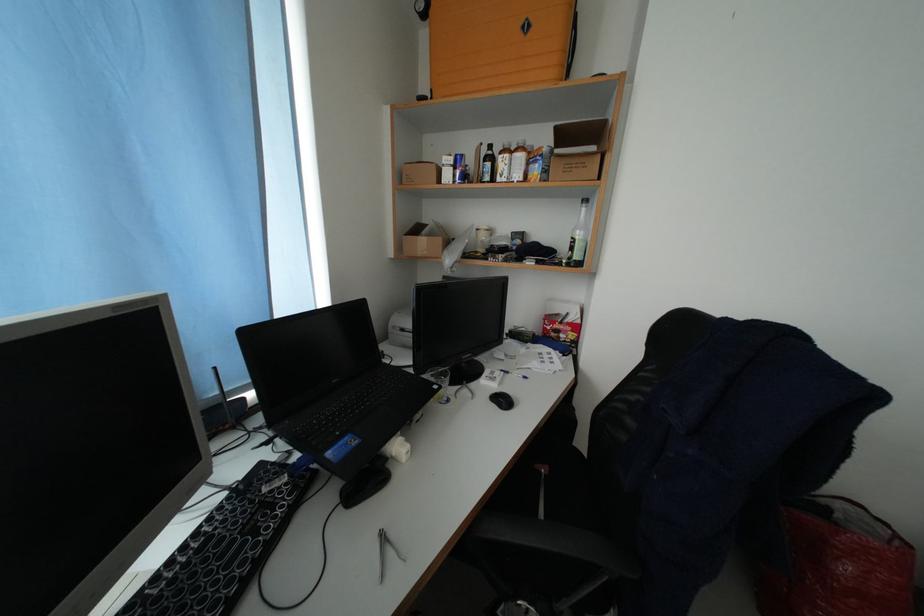
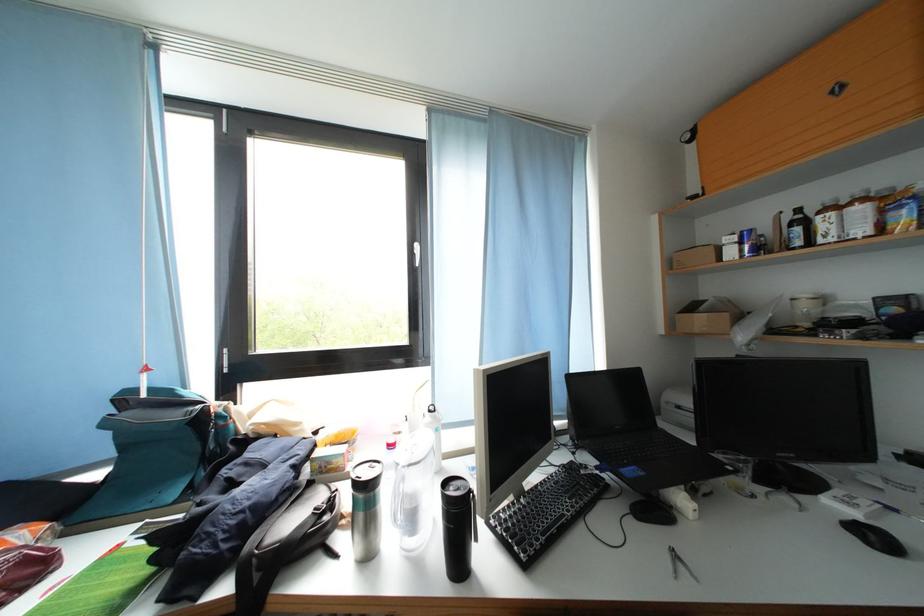
The point at (496, 169) is marked in the first image. Where is the corresponding point in the second image?

(806, 233)